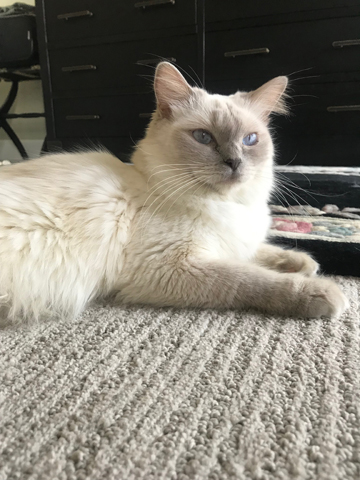
Where is `luggage rack`? The image size is (360, 480). luggage rack is located at coordinates (10, 76), (13, 135), (12, 93), (24, 114), (44, 143).